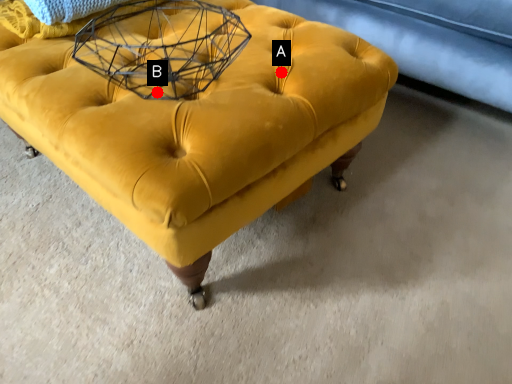
Question: Two points are circled on the image, labeled by A and B beside each circle. Which of the following is the farthest from the observer?

Choices:
 (A) A is further
 (B) B is further

Answer: (A)